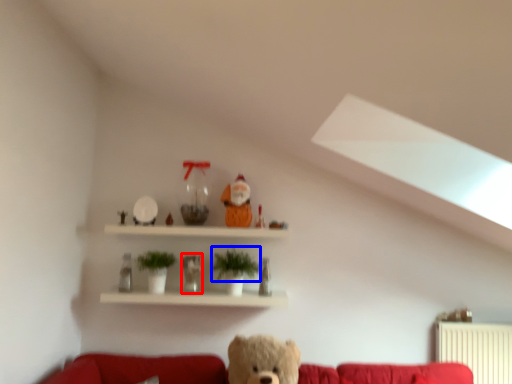
Question: Which point is closer to the camera, figurine (highlighted by a red box) or plant (highlighted by a blue box)?

Choices:
 (A) figurine
 (B) plant

Answer: (B)